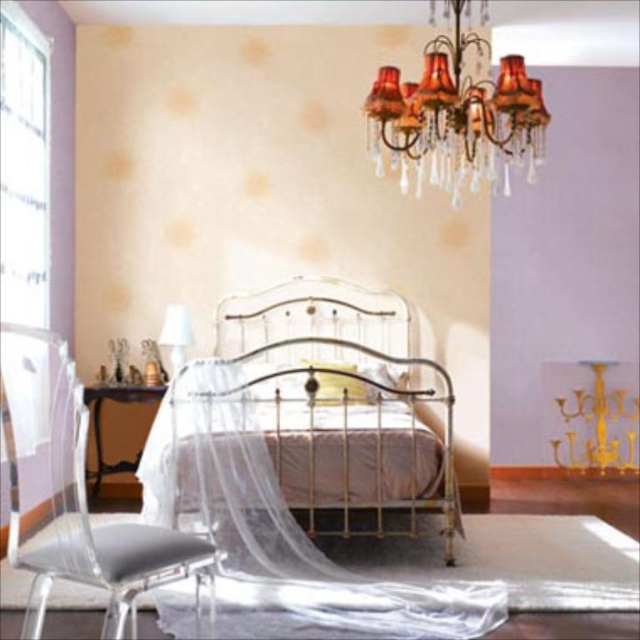
Question: Which object is closer to the camera taking this photo?

Choices:
 (A) white fabric lampshade at center
 (B) gold metallic bed at center
 (C) orange fabric chandelier at upper center
 (D) transparent acrylic chair at lower left

Answer: (D)

Question: Which of these objects is positioned closest to the gold metallic bed at center?

Choices:
 (A) transparent acrylic chair at lower left
 (B) white fabric lampshade at center

Answer: (B)

Question: Is transparent acrylic chair at lower left smaller than white fabric lampshade at center?

Choices:
 (A) yes
 (B) no

Answer: (B)

Question: In this image, where is transparent acrylic chair at lower left located relative to white fabric lampshade at center?

Choices:
 (A) left
 (B) right

Answer: (A)

Question: Can you confirm if gold metallic bed at center is thinner than transparent acrylic chair at lower left?

Choices:
 (A) no
 (B) yes

Answer: (A)

Question: Estimate the real-world distances between objects in this image. Which object is closer to the orange fabric chandelier at upper center?

Choices:
 (A) transparent acrylic chair at lower left
 (B) gold metallic bed at center
 (C) white fabric lampshade at center

Answer: (B)